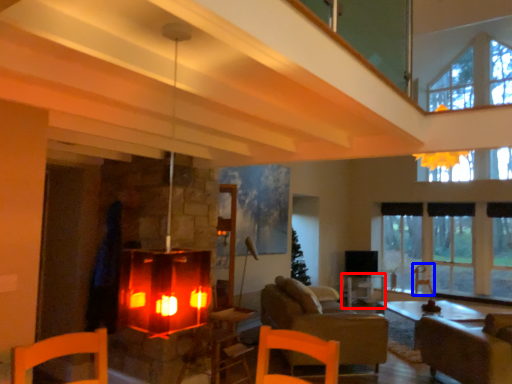
Question: Which of the following is the farthest to the observer, table (highlighted by a red box) or armchair (highlighted by a blue box)?

Choices:
 (A) table
 (B) armchair

Answer: (B)